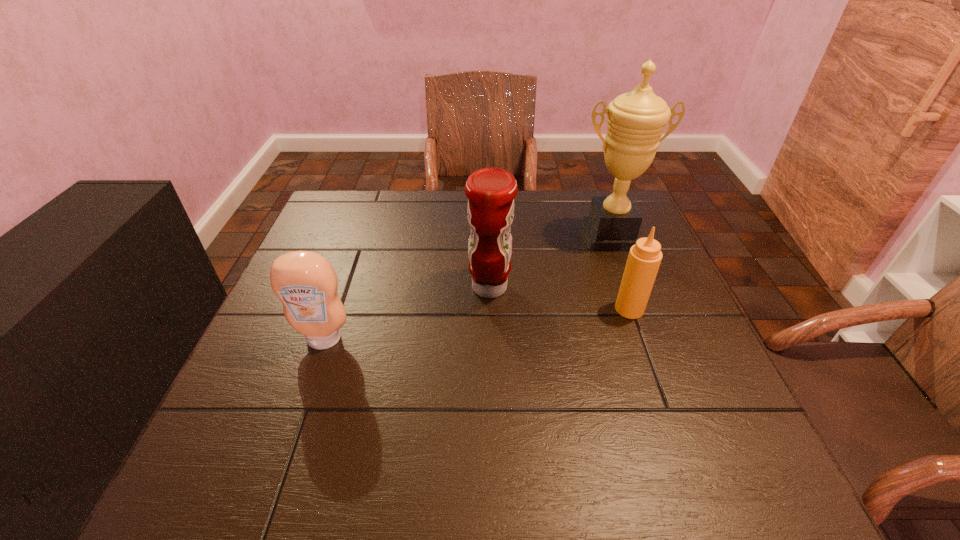
Find the location of a particular element. The width and height of the screenshot is (960, 540). free location located on the label of the nearest object is located at coordinates (308, 384).

Where is `object located in the far edge section of the desktop`? The height and width of the screenshot is (540, 960). object located in the far edge section of the desktop is located at coordinates (636, 120).

The height and width of the screenshot is (540, 960). Identify the location of object positioned at the left edge. (305, 282).

Identify the location of trophy cup that is positioned at the right edge. The width and height of the screenshot is (960, 540). (636, 120).

Where is `condiment situated at the right edge`? condiment situated at the right edge is located at coordinates (644, 258).

Locate an element on the screen. object at the far right corner is located at coordinates (636, 120).

Locate an element on the screen. Image resolution: width=960 pixels, height=540 pixels. vacant area at the far edge of the desktop is located at coordinates (549, 202).

Where is `vacant region at the near edge of the desktop`? vacant region at the near edge of the desktop is located at coordinates (341, 458).

At what (x,y) coordinates should I click in order to perform the action: click on free spot at the left edge of the desktop. Please return your answer as a coordinate pair (x, y). This screenshot has width=960, height=540. Looking at the image, I should click on (249, 350).

You are a GUI agent. You are given a task and a screenshot of the screen. Output one action in this format:
    pyautogui.click(x=<x>, y=<y>)
    Task: Click on the vacant position at the right edge of the desktop
    
    Given the screenshot: What is the action you would take?
    pyautogui.click(x=691, y=332)